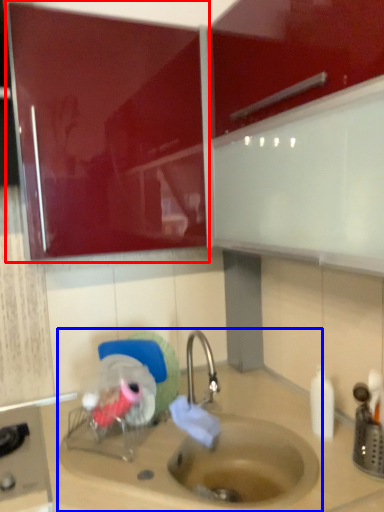
Question: Which object appears farthest to the camera in this image, cabinetry (highlighted by a red box) or sink (highlighted by a blue box)?

Choices:
 (A) cabinetry
 (B) sink

Answer: (A)